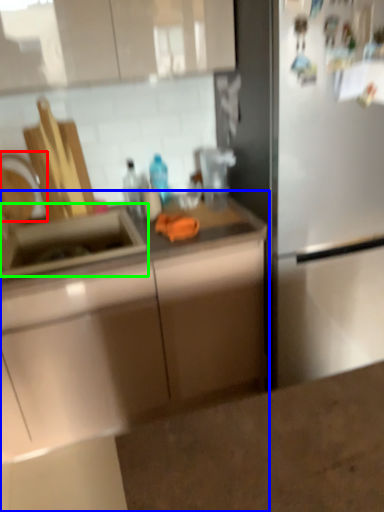
Question: Which object is positioned farthest from faucet (highlighted by a red box)? Select from countertop (highlighted by a blue box) and sink (highlighted by a green box).

Choices:
 (A) countertop
 (B) sink

Answer: (A)